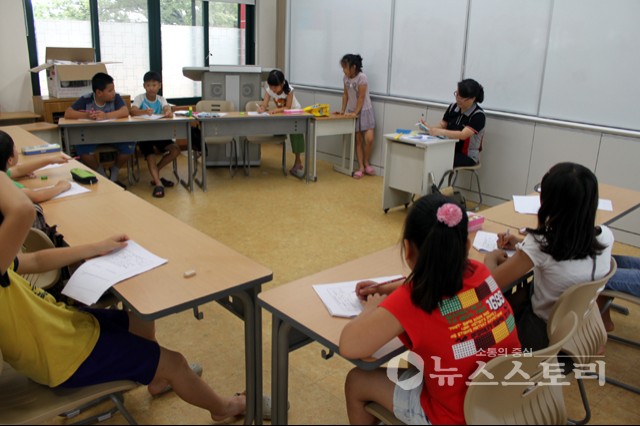
Where is `classroom`? classroom is located at coordinates (326, 207).